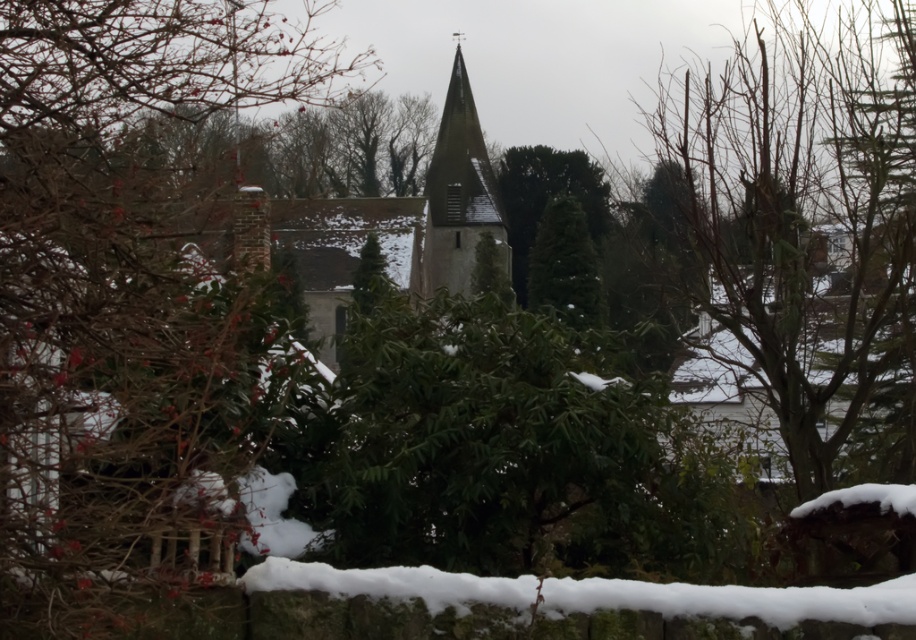
You are standing at the point marked by the coordinate point at center. Looking towards the church steeple in the background, can you see the green leafy bush at center located at point [115,288]? Please explain.

The green leafy bush at center is located at point [115,288], which is directly in front of you. Since you are standing at that point, you would not be able to see the bush as it is right where you are positioned.

You are standing in the winter scene and want to place a small snowman between the green leafy bush at center and the gray stone tower at center. Based on their positions, where should you build the snowman?

The green leafy bush at center is located below the gray stone tower at center, so you should build the snowman between them at the base of the tower, near the bush.

In the scene shown: You are a gardener planning to trim the green leafy bush at center and the gray stone tower at center. Which object requires more trimming effort due to its size?

The gray stone tower at center requires more trimming effort because it is larger than the green leafy bush at center.